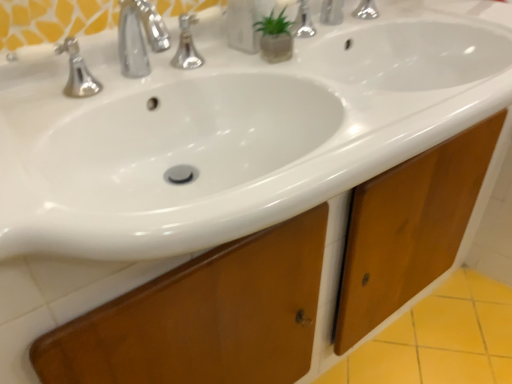
Locate an element on the screen. Image resolution: width=512 pixels, height=384 pixels. white glossy sink at center is located at coordinates (232, 132).

The height and width of the screenshot is (384, 512). What do you see at coordinates (232, 132) in the screenshot?
I see `white glossy sink at center` at bounding box center [232, 132].

This screenshot has height=384, width=512. What do you see at coordinates (243, 25) in the screenshot?
I see `transparent plastic soap dispenser at upper center` at bounding box center [243, 25].

The height and width of the screenshot is (384, 512). In order to click on transparent plastic soap dispenser at upper center in this screenshot , I will do `click(243, 25)`.

At what (x,y) coordinates should I click in order to perform the action: click on white glossy sink at center. Please return your answer as a coordinate pair (x, y). Looking at the image, I should click on (232, 132).

Between transparent plastic soap dispenser at upper center and white glossy sink at center, which one appears on the right side from the viewer's perspective?

white glossy sink at center is more to the right.

Relative to white glossy sink at center, is transparent plastic soap dispenser at upper center in front or behind?

Visually, transparent plastic soap dispenser at upper center is located behind white glossy sink at center.

Does point (251, 39) come behind point (218, 98)?

Yes, point (251, 39) is farther from viewer.

From the image's perspective, is transparent plastic soap dispenser at upper center above or below white glossy sink at center?

Based on their image positions, transparent plastic soap dispenser at upper center is located above white glossy sink at center.

From a real-world perspective, is transparent plastic soap dispenser at upper center below white glossy sink at center?

No, from a real-world perspective, transparent plastic soap dispenser at upper center is not below white glossy sink at center.

Between transparent plastic soap dispenser at upper center and white glossy sink at center, which one has larger width?

Wider between the two is white glossy sink at center.

Considering the sizes of transparent plastic soap dispenser at upper center and white glossy sink at center in the image, is transparent plastic soap dispenser at upper center taller or shorter than white glossy sink at center?

Considering their sizes, transparent plastic soap dispenser at upper center has less height than white glossy sink at center.

Between transparent plastic soap dispenser at upper center and white glossy sink at center, which one has smaller size?

With smaller size is transparent plastic soap dispenser at upper center.

Would you say white glossy sink at center is part of transparent plastic soap dispenser at upper center's contents?

No, white glossy sink at center is not a part of transparent plastic soap dispenser at upper center.

Is transparent plastic soap dispenser at upper center in contact with white glossy sink at center?

No.

Is transparent plastic soap dispenser at upper center turned away from white glossy sink at center?

No, transparent plastic soap dispenser at upper center is not facing away from white glossy sink at center.

How many degrees apart are the facing directions of transparent plastic soap dispenser at upper center and white glossy sink at center?

The angular difference between transparent plastic soap dispenser at upper center and white glossy sink at center is 11.6 degrees.

Where is `soap dispenser located on the left of white glossy sink at center`? This screenshot has height=384, width=512. soap dispenser located on the left of white glossy sink at center is located at coordinates (243, 25).

Is white glossy sink at center at the left side of transparent plastic soap dispenser at upper center?

No.

Which object is further away from the camera, white glossy sink at center or transparent plastic soap dispenser at upper center?

transparent plastic soap dispenser at upper center is behind.

Does point (184, 227) come closer to viewer compared to point (240, 13)?

That is True.

From the image's perspective, is white glossy sink at center on transparent plastic soap dispenser at upper center?

Actually, white glossy sink at center appears below transparent plastic soap dispenser at upper center in the image.

From a real-world perspective, is white glossy sink at center positioned above or below transparent plastic soap dispenser at upper center?

Clearly, from a real-world perspective, white glossy sink at center is below transparent plastic soap dispenser at upper center.

Can you confirm if white glossy sink at center is thinner than transparent plastic soap dispenser at upper center?

No, white glossy sink at center is not thinner than transparent plastic soap dispenser at upper center.

Who is taller, white glossy sink at center or transparent plastic soap dispenser at upper center?

white glossy sink at center is taller.

Between white glossy sink at center and transparent plastic soap dispenser at upper center, which one has smaller size?

With smaller size is transparent plastic soap dispenser at upper center.

Is white glossy sink at center spatially inside transparent plastic soap dispenser at upper center, or outside of it?

white glossy sink at center exists outside the volume of transparent plastic soap dispenser at upper center.

Looking at this image, is white glossy sink at center touching transparent plastic soap dispenser at upper center?

They are not placed beside each other.

Could you tell me if white glossy sink at center is facing transparent plastic soap dispenser at upper center?

No, white glossy sink at center does not turn towards transparent plastic soap dispenser at upper center.

Looking at this image, how distant is white glossy sink at center from transparent plastic soap dispenser at upper center?

white glossy sink at center and transparent plastic soap dispenser at upper center are 11.61 inches apart from each other.

You are a GUI agent. You are given a task and a screenshot of the screen. Output one action in this format:
    pyautogui.click(x=<x>, y=<y>)
    Task: Click on the sink in front of the transparent plastic soap dispenser at upper center
    The height and width of the screenshot is (384, 512).
    Given the screenshot: What is the action you would take?
    pyautogui.click(x=232, y=132)

You are a GUI agent. You are given a task and a screenshot of the screen. Output one action in this format:
    pyautogui.click(x=<x>, y=<y>)
    Task: Click on the sink located below the transparent plastic soap dispenser at upper center (from the image's perspective)
    
    Given the screenshot: What is the action you would take?
    pyautogui.click(x=232, y=132)

Where is `sink lying on the right of transparent plastic soap dispenser at upper center`? This screenshot has height=384, width=512. sink lying on the right of transparent plastic soap dispenser at upper center is located at coordinates (232, 132).